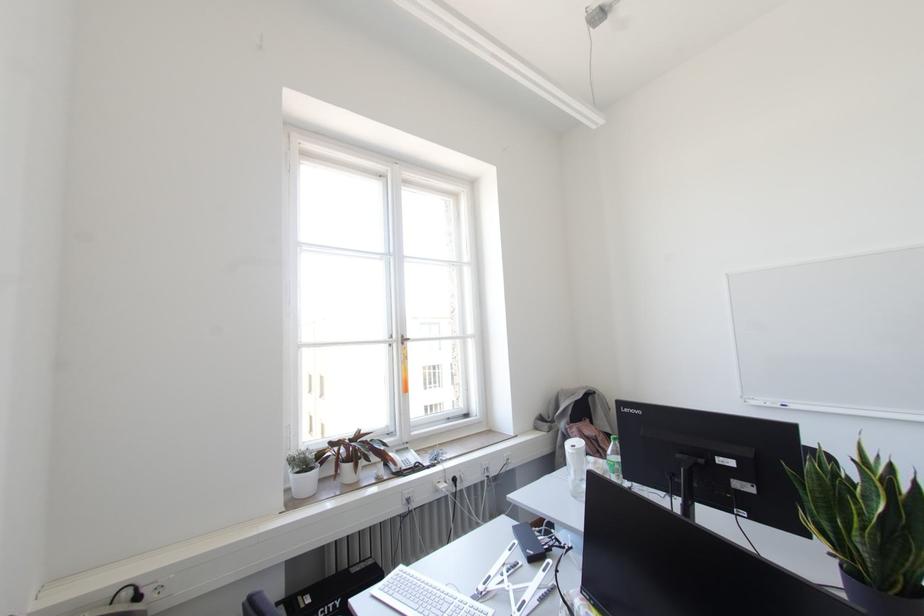
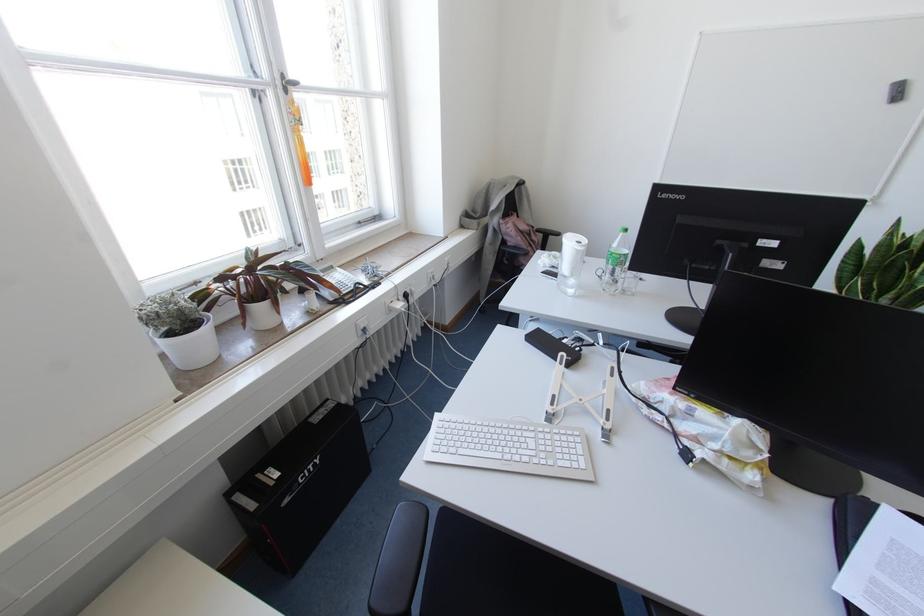
The point at (355, 466) is marked in the first image. Where is the corresponding point in the second image?

(274, 302)